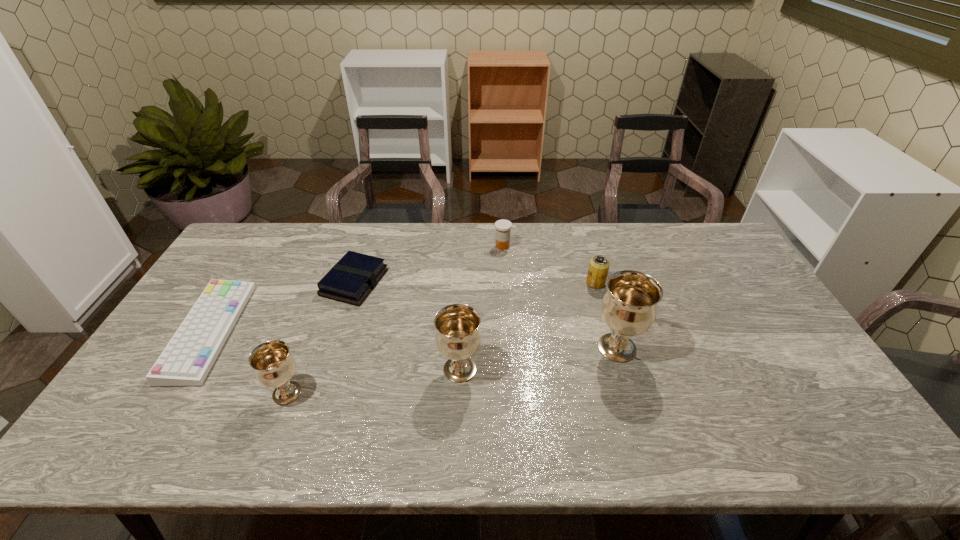
Choose which chalice is the second nearest neighbor to the medicine. Please provide its 2D coordinates. Your answer should be formatted as a tuple, i.e. [(x, y)], where the tuple contains the x and y coordinates of a point satisfying the conditions above.

[(458, 337)]

Locate which chalice is the closest to the leftmost object. Please provide its 2D coordinates. Your answer should be formatted as a tuple, i.e. [(x, y)], where the tuple contains the x and y coordinates of a point satisfying the conditions above.

[(273, 365)]

I want to click on free location that satisfies the following two spatial constraints: 1. on the front side of the tallest chalice; 2. on the left side of the leftmost object, so click(x=200, y=348).

Identify the location of blank space that satisfies the following two spatial constraints: 1. on the front side of the fifth shortest object; 2. on the left side of the leftmost object. (172, 393).

The image size is (960, 540). Identify the location of vacant space that satisfies the following two spatial constraints: 1. on the label of the third object from right to left; 2. on the front side of the leftmost object. (508, 332).

Where is `free point that satisfies the following two spatial constraints: 1. on the back side of the tallest object; 2. on the label of the fifth object from left to right`? free point that satisfies the following two spatial constraints: 1. on the back side of the tallest object; 2. on the label of the fifth object from left to right is located at coordinates (587, 246).